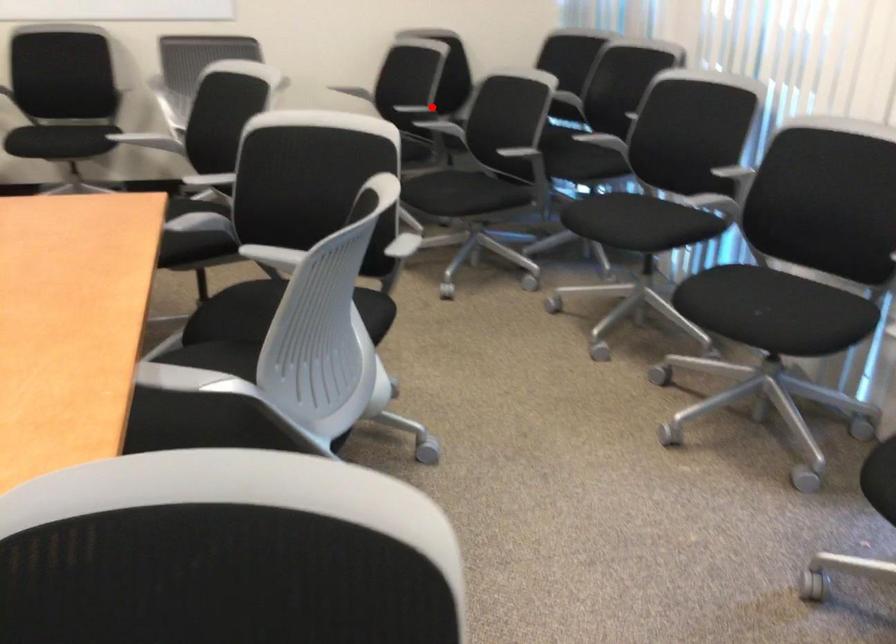
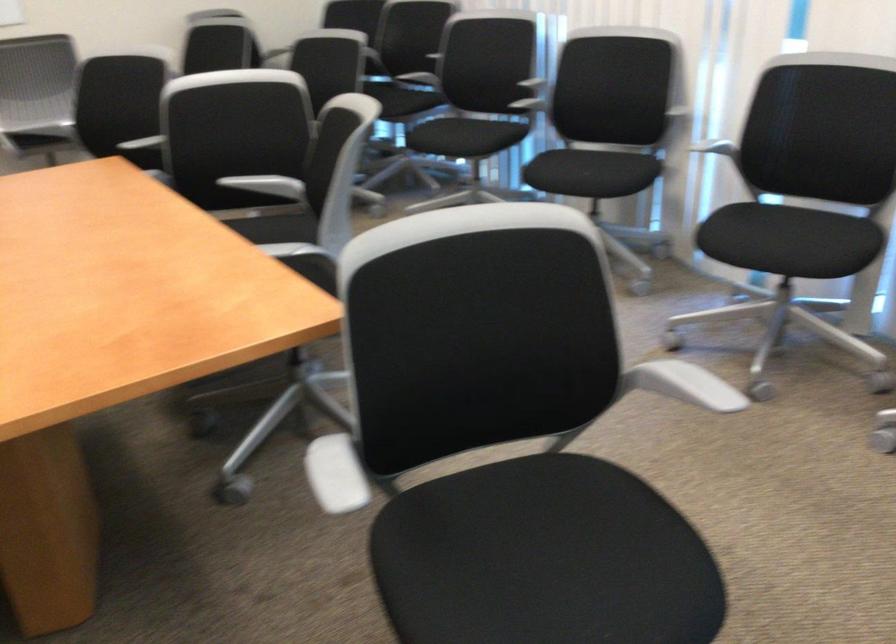
Question: I am providing you with two images of the same scene from different viewpoints. A red point is marked on the first image. Is the red point's position out of view in image 2?

Choices:
 (A) Yes
 (B) No

Answer: (A)